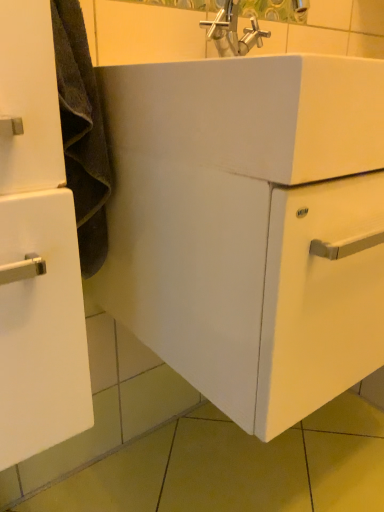
Question: Is white matte cabinet at left outside white glossy sink at center?

Choices:
 (A) yes
 (B) no

Answer: (A)

Question: From the image's perspective, is white matte cabinet at left located beneath white glossy sink at center?

Choices:
 (A) yes
 (B) no

Answer: (A)

Question: Would you say white matte cabinet at left is a long distance from white glossy sink at center?

Choices:
 (A) no
 (B) yes

Answer: (A)

Question: From a real-world perspective, is white matte cabinet at left on top of white glossy sink at center?

Choices:
 (A) yes
 (B) no

Answer: (B)

Question: Is white matte cabinet at left surrounding white glossy sink at center?

Choices:
 (A) no
 (B) yes

Answer: (A)

Question: Considering the relative sizes of white matte cabinet at left and white glossy sink at center in the image provided, is white matte cabinet at left thinner than white glossy sink at center?

Choices:
 (A) yes
 (B) no

Answer: (A)

Question: Is white glossy sink at center bigger than white matte cabinet at left?

Choices:
 (A) yes
 (B) no

Answer: (A)

Question: Is the depth of white glossy sink at center less than that of white matte cabinet at left?

Choices:
 (A) no
 (B) yes

Answer: (B)

Question: Can white matte cabinet at left be found inside white glossy sink at center?

Choices:
 (A) no
 (B) yes

Answer: (A)

Question: Considering the relative sizes of white glossy sink at center and white matte cabinet at left in the image provided, is white glossy sink at center wider than white matte cabinet at left?

Choices:
 (A) no
 (B) yes

Answer: (B)

Question: Is white glossy sink at center further to the viewer compared to white matte cabinet at left?

Choices:
 (A) no
 (B) yes

Answer: (A)

Question: Can you confirm if white glossy sink at center is taller than white matte cabinet at left?

Choices:
 (A) yes
 (B) no

Answer: (B)

Question: Considering their positions, is white glossy sink at center located in front of or behind white matte cabinet at left?

Choices:
 (A) behind
 (B) front

Answer: (B)